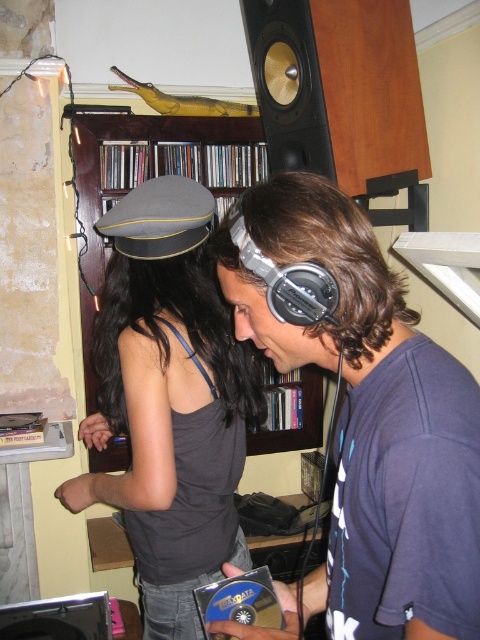
You are standing in the studio and need to place a new speaker. There are two points marked on the wall where you can install it. The first point is at coordinate point [299,33] and the second is at point [101,129]. Which point is closer to you so that the speaker will be more visible?

The point at coordinate point [299,33] is closer to the viewer than point [101,129], so placing the speaker there will make it more visible.

You are a photographer setting up for a portrait session in the studio. You need to ensure that the matte black headphones at center and the matte gray cap at center are both visible in the frame. Based on their positions, which object is closer to the camera?

The matte black headphones at center is in front of the matte gray cap at center, so the matte black headphones at center is closer to the camera.